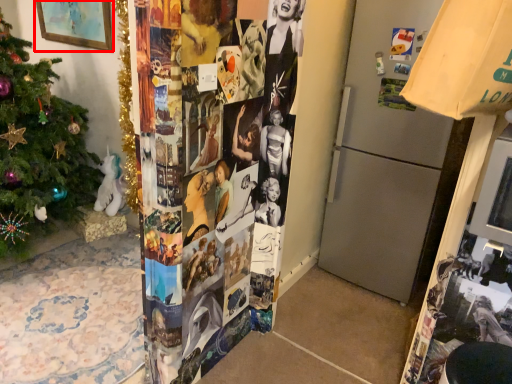
Question: From the image's perspective, where is picture frame (annotated by the red box) located relative to christmas tree?

Choices:
 (A) below
 (B) above

Answer: (B)